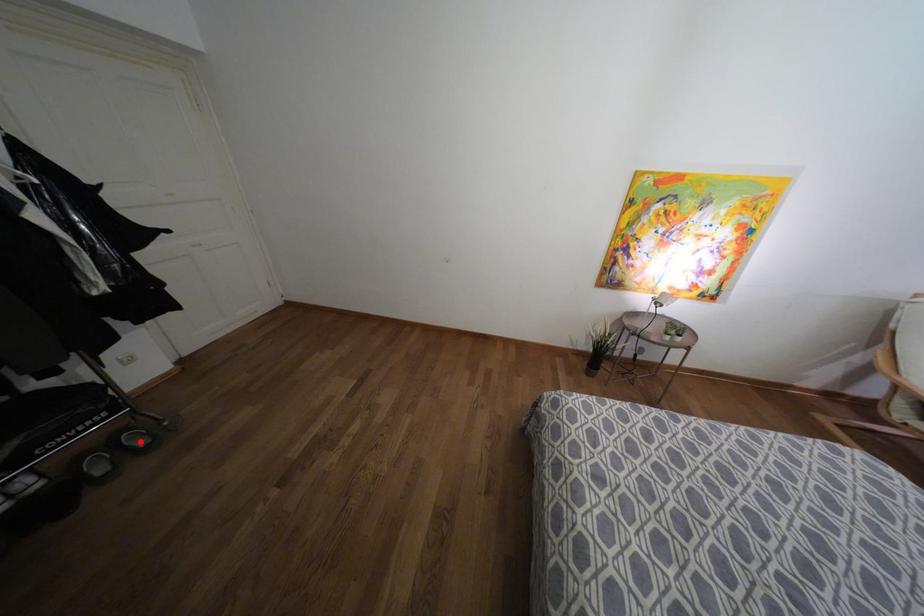
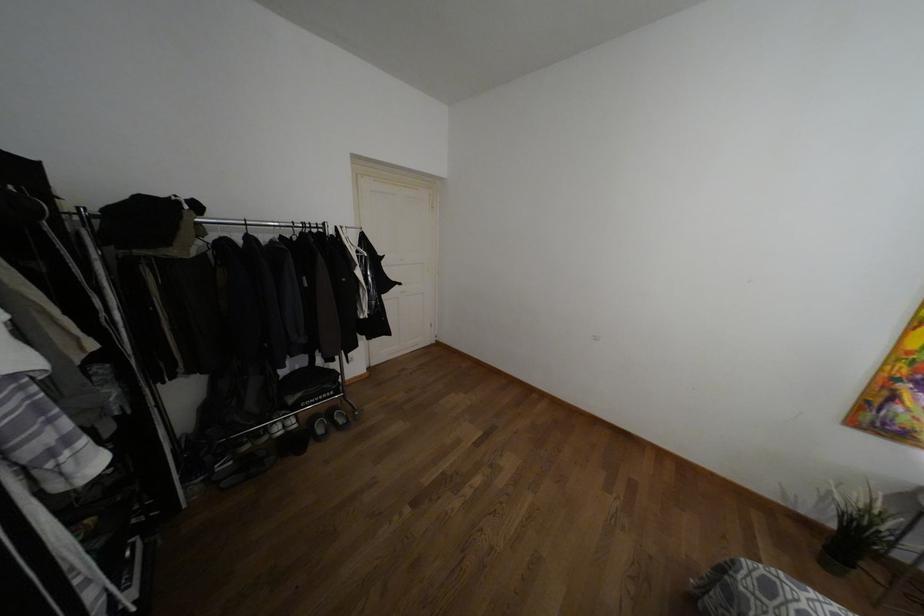
Question: A red point is marked in image1. In image2, is the corresponding 3D point closer to the camera or farther? Reply with the corresponding letter.

Choices:
 (A) The corresponding 3D point is closer.
 (B) The corresponding 3D point is farther.

Answer: (B)